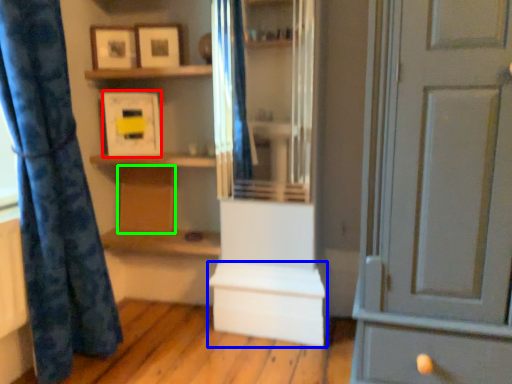
Question: Which object is positioned closest to picture frame (highlighted by a red box)? Select from cabinetry (highlighted by a blue box) and cabinetry (highlighted by a green box).

Choices:
 (A) cabinetry
 (B) cabinetry

Answer: (B)